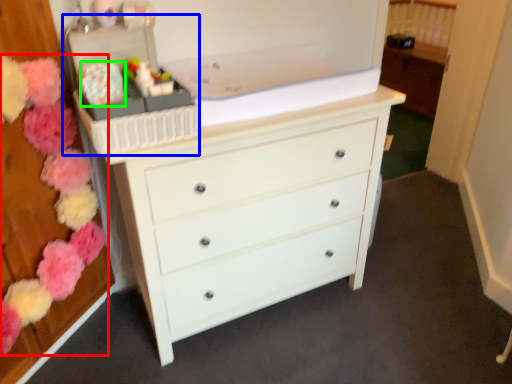
Question: Estimate the real-world distances between objects in this image. Which object is closer to flower (highlighted by a red box), storage box (highlighted by a blue box) or flower (highlighted by a green box)?

Choices:
 (A) storage box
 (B) flower

Answer: (A)